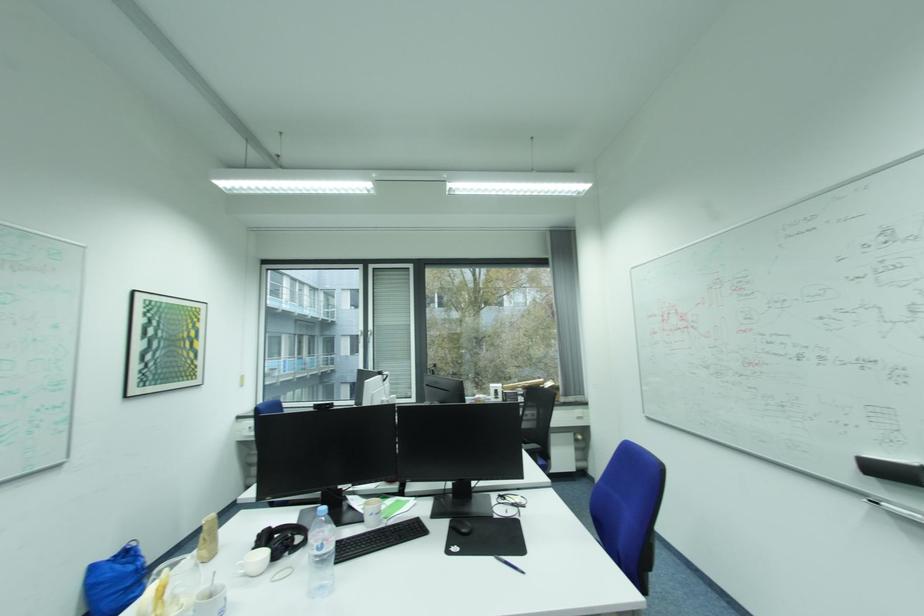
The location [282,539] corresponds to which object?

It refers to a black headphones.